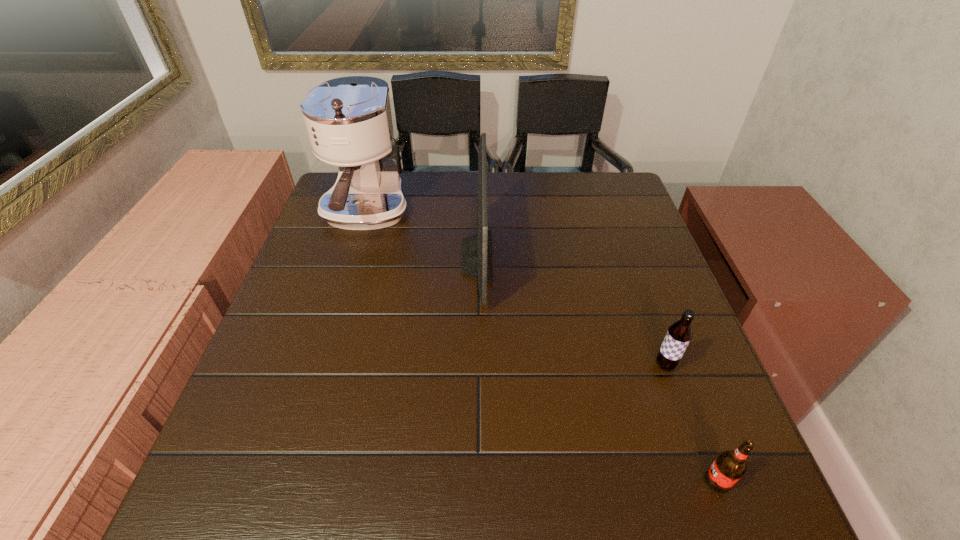
At what (x,y) coordinates should I click in order to perform the action: click on free spot located 0.310m on the back of the second nearest object. Please return your answer as a coordinate pair (x, y). The image size is (960, 540). Looking at the image, I should click on (626, 258).

Find the location of a particular element. This screenshot has height=540, width=960. vacant space situated on the left of the shortest object is located at coordinates (568, 481).

In order to click on coffee maker situated at the far edge in this screenshot , I will do `click(348, 120)`.

At what (x,y) coordinates should I click in order to perform the action: click on monitor that is at the far edge. Please return your answer as a coordinate pair (x, y). Looking at the image, I should click on (476, 262).

At what (x,y) coordinates should I click in order to perform the action: click on object present at the near edge. Please return your answer as a coordinate pair (x, y). Looking at the image, I should click on (729, 466).

Image resolution: width=960 pixels, height=540 pixels. I want to click on object at the left edge, so click(x=348, y=120).

You are a GUI agent. You are given a task and a screenshot of the screen. Output one action in this format:
    pyautogui.click(x=<x>, y=<y>)
    Task: Click on the object present at the far left corner
    
    Given the screenshot: What is the action you would take?
    pyautogui.click(x=348, y=120)

Find the location of a particular element. object present at the near right corner is located at coordinates (729, 466).

In the image, there is a desktop. Identify the location of free space at the far edge. (433, 195).

This screenshot has height=540, width=960. In the image, there is a desktop. Find the location of `free space at the left edge`. free space at the left edge is located at coordinates (300, 375).